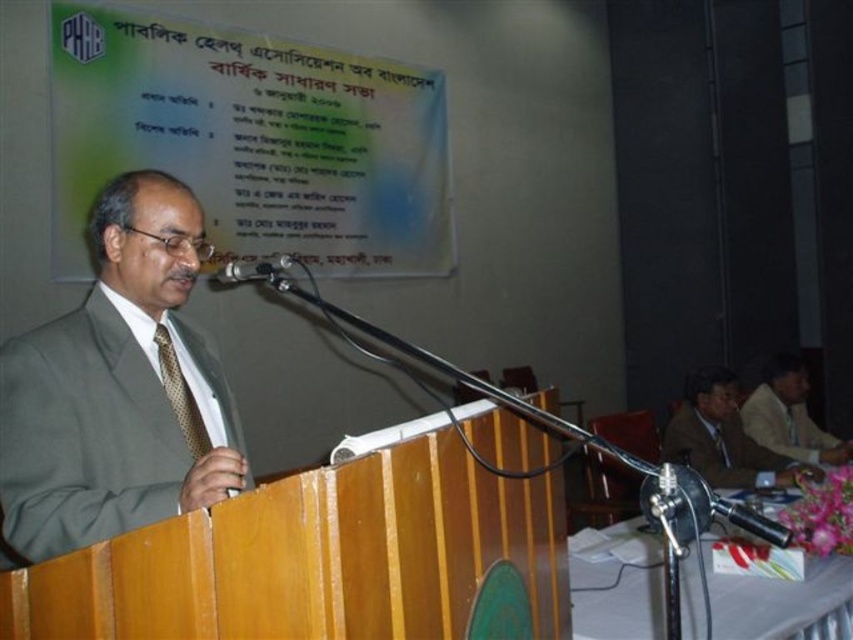
Is matte green suit at center to the left of light brown suit at right from the viewer's perspective?

Indeed, matte green suit at center is positioned on the left side of light brown suit at right.

Is matte green suit at center above light brown suit at right?

Correct, matte green suit at center is located above light brown suit at right.

At what (x,y) coordinates should I click in order to perform the action: click on matte green suit at center. Please return your answer as a coordinate pair (x, y). Image resolution: width=853 pixels, height=640 pixels. Looking at the image, I should click on (117, 387).

Which is more to the left, matte green suit at center or gold textured tie at left?

matte green suit at center is more to the left.

This screenshot has width=853, height=640. Describe the element at coordinates (117, 387) in the screenshot. I see `matte green suit at center` at that location.

The image size is (853, 640). Identify the location of matte green suit at center. (117, 387).

Is matte green suit at center shorter than metallic silver microphone at center?

No, matte green suit at center is not shorter than metallic silver microphone at center.

Which is more to the left, matte green suit at center or metallic silver microphone at center?

matte green suit at center

What do you see at coordinates (117, 387) in the screenshot? I see `matte green suit at center` at bounding box center [117, 387].

Image resolution: width=853 pixels, height=640 pixels. I want to click on matte green suit at center, so click(117, 387).